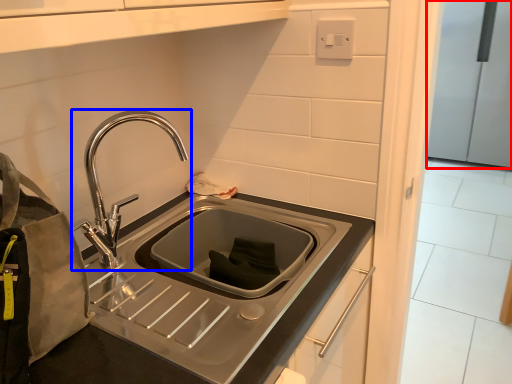
Question: Which object is closer to the camera taking this photo, appliance (highlighted by a red box) or tap (highlighted by a blue box)?

Choices:
 (A) appliance
 (B) tap

Answer: (B)